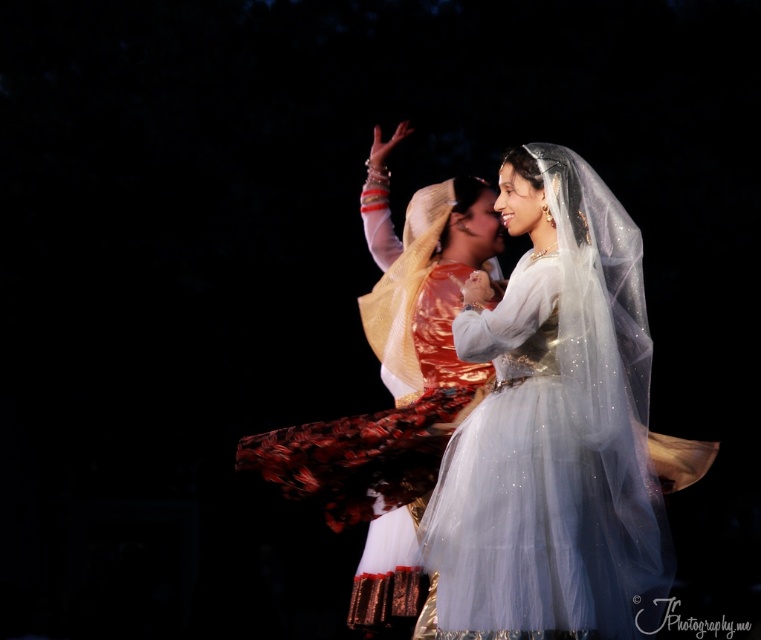
Question: Does silvery tulle dress at center have a lesser width compared to matte gold veil at center?

Choices:
 (A) no
 (B) yes

Answer: (B)

Question: Is silvery tulle dress at center smaller than matte gold veil at center?

Choices:
 (A) yes
 (B) no

Answer: (A)

Question: Is the position of silvery tulle dress at center more distant than that of matte gold veil at center?

Choices:
 (A) yes
 (B) no

Answer: (B)

Question: Which point is farther from the camera taking this photo?

Choices:
 (A) (597, 308)
 (B) (263, 477)

Answer: (B)